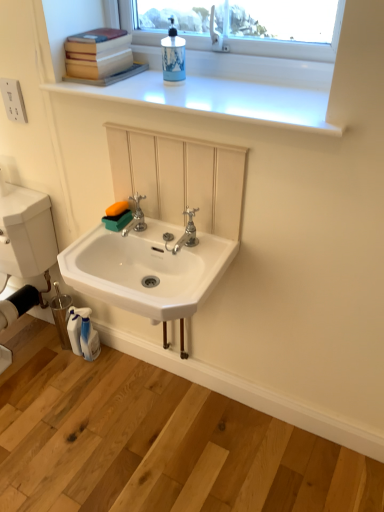
At what (x,y) coordinates should I click in order to perform the action: click on vacant region to the right of polished chrome faucet at center, positioned as the 2th tap in left-to-right order. Please return your answer as a coordinate pair (x, y). Looking at the image, I should click on (211, 249).